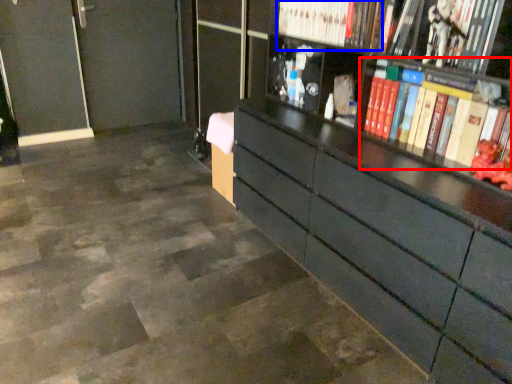
Question: Which of the following is the closest to the observer, book (highlighted by a red box) or book (highlighted by a blue box)?

Choices:
 (A) book
 (B) book

Answer: (A)